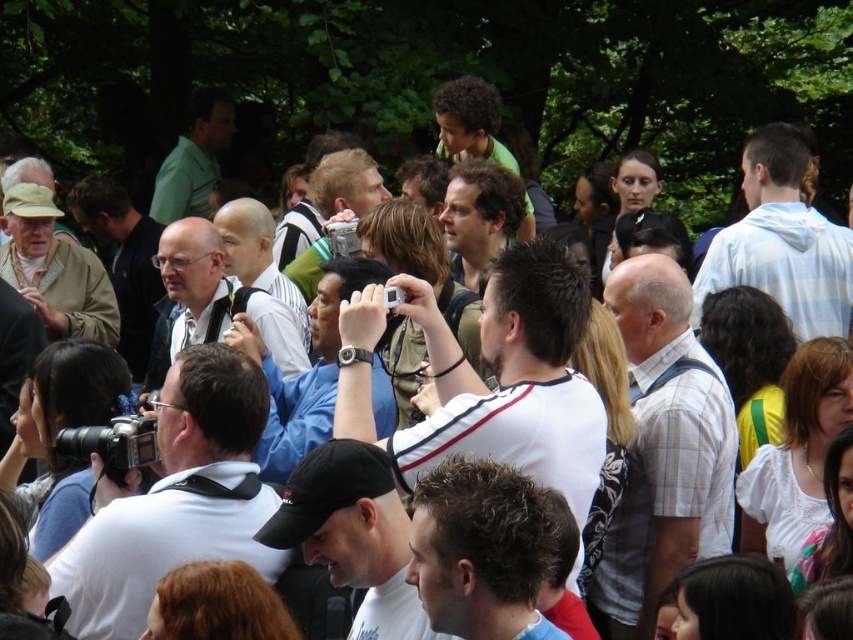
Question: Which point appears closest to the camera in this image?

Choices:
 (A) (259, 416)
 (B) (608, 275)
 (C) (125, 220)
 (D) (390, 464)

Answer: (D)

Question: Can you confirm if dark brown leather jacket at center is positioned to the right of matte white shirt at center?

Choices:
 (A) yes
 (B) no

Answer: (B)

Question: Which object is closer to the camera taking this photo?

Choices:
 (A) white hoodie at upper right
 (B) black cap at center
 (C) white matte camera at center-left

Answer: (B)

Question: Which is nearer to the black cap at center?

Choices:
 (A) matte black glasses at center
 (B) white checkered shirt at center
 (C) dark brown leather jacket at center
 (D) white matte shirt at center

Answer: (D)

Question: Does black cap at center come behind white hoodie at upper right?

Choices:
 (A) yes
 (B) no

Answer: (B)

Question: Can you confirm if white matte shirt at center is positioned above matte white shirt at center?

Choices:
 (A) yes
 (B) no

Answer: (B)